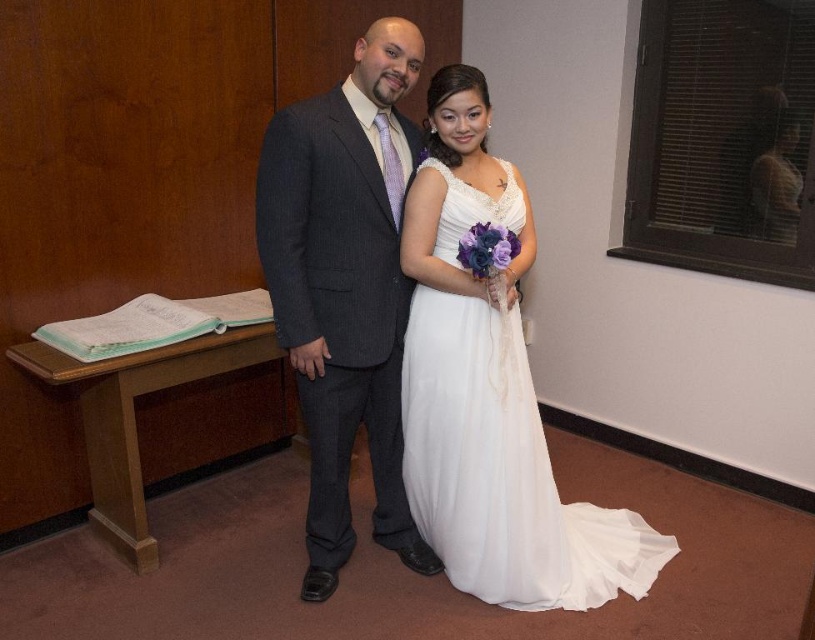
Looking at this image, can you confirm if white satin dress at center is positioned above dark gray pinstripe suit at center?

Incorrect, white satin dress at center is not positioned above dark gray pinstripe suit at center.

Does white satin dress at center have a greater height compared to dark gray pinstripe suit at center?

Correct, white satin dress at center is much taller as dark gray pinstripe suit at center.

Find the location of a particular element. This screenshot has height=640, width=815. white satin dress at center is located at coordinates (490, 392).

In order to click on white satin dress at center in this screenshot , I will do (490, 392).

Can you confirm if white satin dress at center is positioned to the right of white chiffon dress at center?

Incorrect, white satin dress at center is not on the right side of white chiffon dress at center.

Between white satin dress at center and white chiffon dress at center, which one appears on the left side from the viewer's perspective?

From the viewer's perspective, white satin dress at center appears more on the left side.

Does point (417, 195) come in front of point (527, 390)?

Yes, point (417, 195) is closer to viewer.

Where is `white satin dress at center`? white satin dress at center is located at coordinates (490, 392).

Who is more forward, (388, 538) or (544, 445)?

Point (544, 445)

What do you see at coordinates (346, 288) in the screenshot?
I see `dark gray pinstripe suit at center` at bounding box center [346, 288].

Find the location of a particular element. dark gray pinstripe suit at center is located at coordinates (346, 288).